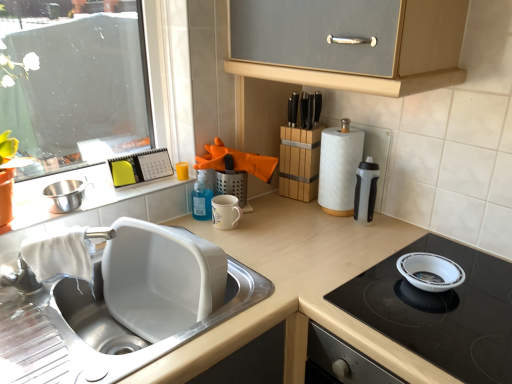
The height and width of the screenshot is (384, 512). In order to click on vacant area situated to the left side of white textured paper towel at right in this screenshot , I will do `click(293, 220)`.